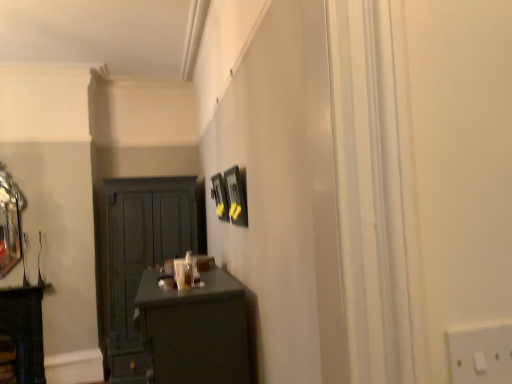
Question: Is matte black desk at lower left turned away from matte black picture frame at center, which is the second picture frame from left to right?

Choices:
 (A) yes
 (B) no

Answer: (B)

Question: Considering the relative sizes of matte black desk at lower left and matte black picture frame at center, which ranks as the first picture frame in right-to-left order, in the image provided, is matte black desk at lower left wider than matte black picture frame at center, which ranks as the first picture frame in right-to-left order,?

Choices:
 (A) yes
 (B) no

Answer: (A)

Question: Would you say matte black desk at lower left is outside matte black picture frame at center, which ranks as the first picture frame in right-to-left order?

Choices:
 (A) yes
 (B) no

Answer: (A)

Question: Are matte black desk at lower left and matte black picture frame at center, which ranks as the first picture frame in right-to-left order, beside each other?

Choices:
 (A) no
 (B) yes

Answer: (A)

Question: Is matte black desk at lower left thinner than matte black picture frame at center, which ranks as the first picture frame in right-to-left order?

Choices:
 (A) no
 (B) yes

Answer: (A)

Question: In terms of size, does matte black picture frame at center, which is the first picture frame in front-to-back order, appear bigger or smaller than polished silver mirror at left?

Choices:
 (A) big
 (B) small

Answer: (B)

Question: Is point (244, 210) positioned closer to the camera than point (10, 236)?

Choices:
 (A) farther
 (B) closer

Answer: (B)

Question: Based on their positions, is matte black picture frame at center, which is the first picture frame in front-to-back order, located to the left or right of polished silver mirror at left?

Choices:
 (A) left
 (B) right

Answer: (B)

Question: In the image, is matte black picture frame at center, positioned as the second picture frame in back-to-front order, positioned in front of or behind polished silver mirror at left?

Choices:
 (A) behind
 (B) front

Answer: (B)

Question: Is matte dark wood cabinet at left inside or outside of polished silver mirror at left?

Choices:
 (A) outside
 (B) inside

Answer: (A)

Question: In terms of height, does matte dark wood cabinet at left look taller or shorter compared to polished silver mirror at left?

Choices:
 (A) tall
 (B) short

Answer: (B)

Question: From a real-world perspective, relative to polished silver mirror at left, is matte dark wood cabinet at left vertically above or below?

Choices:
 (A) below
 (B) above

Answer: (A)

Question: Based on their positions, is matte dark wood cabinet at left located to the left or right of polished silver mirror at left?

Choices:
 (A) right
 (B) left

Answer: (A)

Question: Is matte dark wood cabinet at left bigger or smaller than matte black picture frame at center, which is the second picture frame from left to right?

Choices:
 (A) big
 (B) small

Answer: (A)

Question: Is matte dark wood cabinet at left inside or outside of matte black picture frame at center, positioned as the second picture frame in back-to-front order?

Choices:
 (A) inside
 (B) outside

Answer: (B)